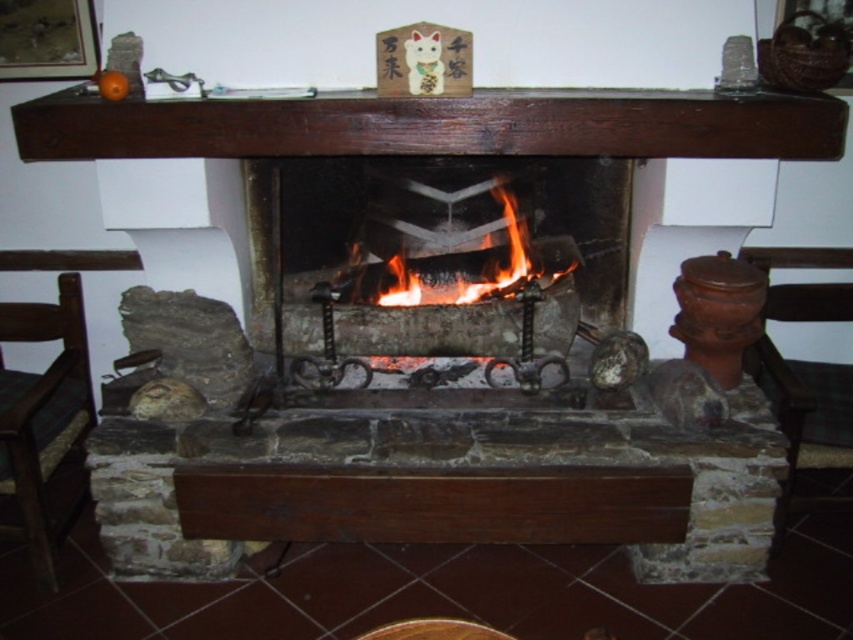
Is green fabric chair at lower left positioned in front of flaming wood at center?

Yes, green fabric chair at lower left is closer to the viewer.

Can you confirm if green fabric chair at lower left is smaller than flaming wood at center?

Incorrect, green fabric chair at lower left is not smaller in size than flaming wood at center.

Does point (68, 449) come closer to viewer compared to point (357, 273)?

Yes, point (68, 449) is closer to viewer.

Find the location of `green fabric chair at lower left`. green fabric chair at lower left is located at coordinates (44, 417).

Does dark brown wood at upper center have a greater height compared to flaming wood at center?

No.

Is dark brown wood at upper center wider than flaming wood at center?

Indeed, dark brown wood at upper center has a greater width compared to flaming wood at center.

Which is in front, point (268, 141) or point (399, 250)?

Point (268, 141)

The height and width of the screenshot is (640, 853). Find the location of `dark brown wood at upper center`. dark brown wood at upper center is located at coordinates (437, 125).

You are a GUI agent. You are given a task and a screenshot of the screen. Output one action in this format:
    pyautogui.click(x=<x>, y=<y>)
    Task: Click on the dark brown wood at upper center
    The width and height of the screenshot is (853, 640).
    Given the screenshot: What is the action you would take?
    pyautogui.click(x=437, y=125)

Between dark brown wood at upper center and green fabric chair at lower left, which one appears on the left side from the viewer's perspective?

Positioned to the left is green fabric chair at lower left.

Does point (473, 104) come in front of point (38, 490)?

Yes, point (473, 104) is in front of point (38, 490).

The width and height of the screenshot is (853, 640). In order to click on dark brown wood at upper center in this screenshot , I will do `click(437, 125)`.